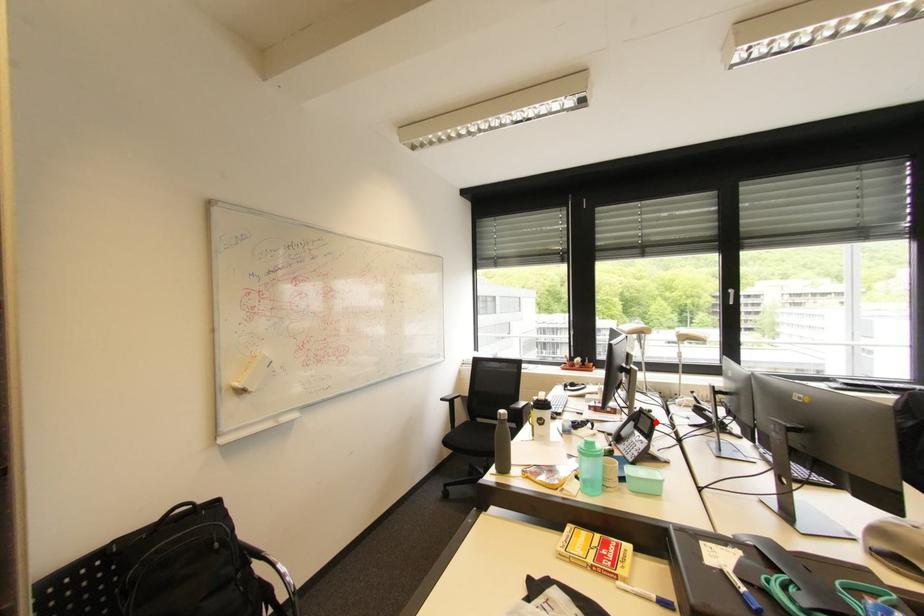
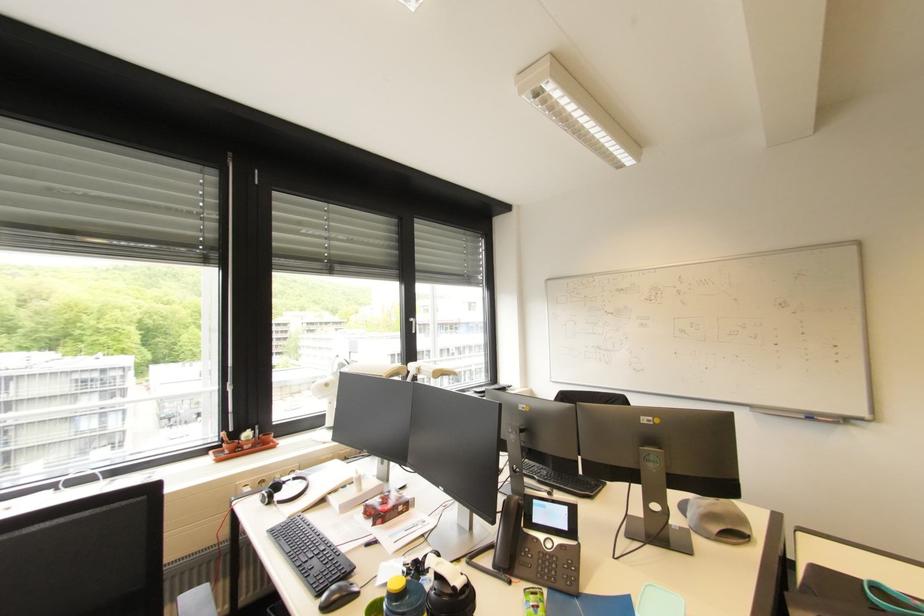
The point at the highlighted location is marked in the first image. Where is the corresponding point in the second image?

(572, 509)